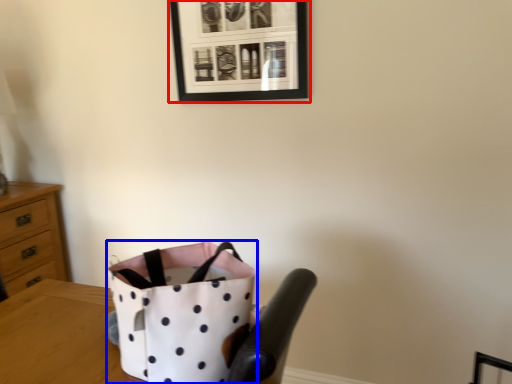
Question: Which object is further to the camera taking this photo, picture frame (highlighted by a red box) or handbag (highlighted by a blue box)?

Choices:
 (A) picture frame
 (B) handbag

Answer: (A)